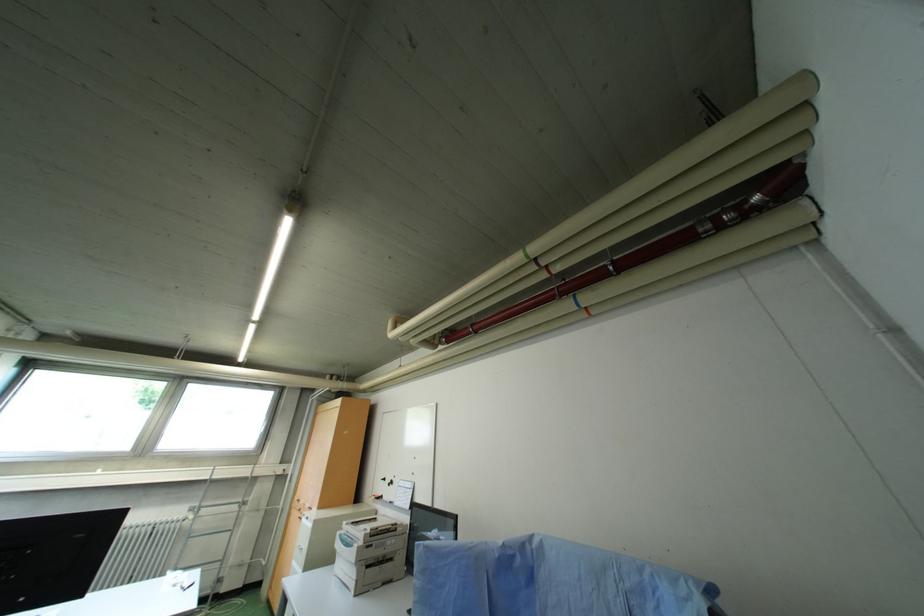
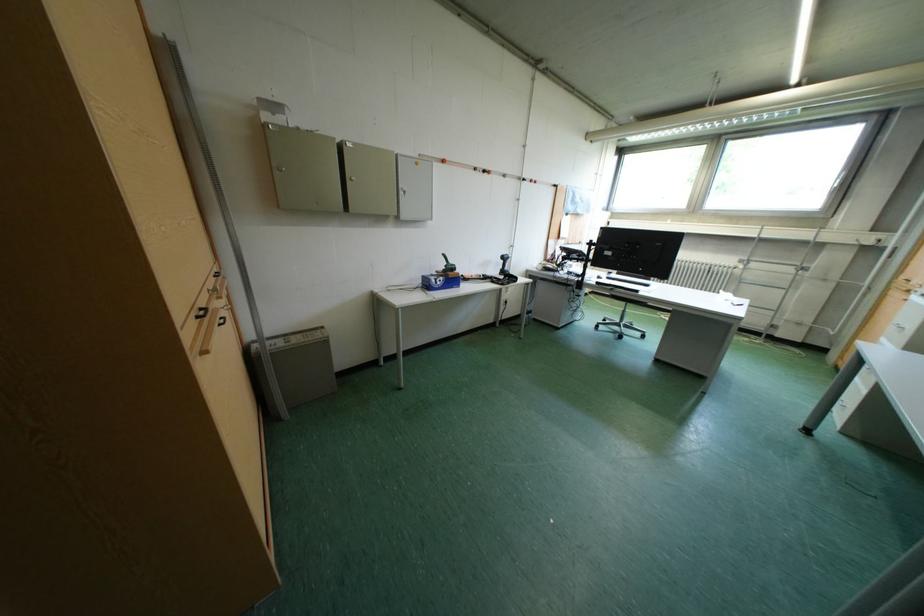
The first image is from the beginning of the video and the second image is from the end. How did the camera likely rotate when shooting the video?

The camera rotated toward left-down.